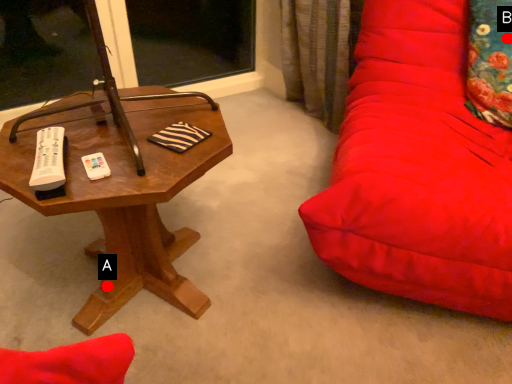
Question: Two points are circled on the image, labeled by A and B beside each circle. Which point is closer to the camera?

Choices:
 (A) A is closer
 (B) B is closer

Answer: (A)